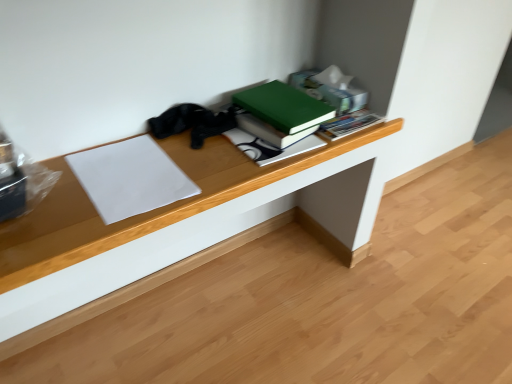
Question: Is green matte book at upper center, positioned as the second paperback book in left-to-right order, located outside wooden desk at center?

Choices:
 (A) yes
 (B) no

Answer: (A)

Question: Does green matte book at upper center, which is the 1th paperback book from back to front, come in front of wooden desk at center?

Choices:
 (A) yes
 (B) no

Answer: (A)

Question: Does green matte book at upper center, which is counted as the 2th paperback book, starting from the front, have a greater width compared to wooden desk at center?

Choices:
 (A) no
 (B) yes

Answer: (B)

Question: Does green matte book at upper center, placed as the first paperback book when sorted from top to bottom, have a lesser width compared to wooden desk at center?

Choices:
 (A) yes
 (B) no

Answer: (B)

Question: From a real-world perspective, is green matte book at upper center, acting as the first paperback book starting from the right, located higher than wooden desk at center?

Choices:
 (A) yes
 (B) no

Answer: (A)

Question: In terms of height, does green matte book at upper center, acting as the first paperback book starting from the right, look taller or shorter compared to white paper at left, which appears as the second paperback book when viewed from the right?

Choices:
 (A) short
 (B) tall

Answer: (B)

Question: From the image's perspective, is green matte book at upper center, which is the 1th paperback book from back to front, above or below white paper at left, arranged as the first paperback book when viewed from the front?

Choices:
 (A) above
 (B) below

Answer: (A)

Question: Is point (329, 114) positioned closer to the camera than point (100, 195)?

Choices:
 (A) farther
 (B) closer

Answer: (A)

Question: From a real-world perspective, is green matte book at upper center, which is the 1th paperback book from back to front, above or below white paper at left, placed as the first paperback book when sorted from bottom to top?

Choices:
 (A) below
 (B) above

Answer: (B)

Question: From a real-world perspective, relative to white paper at left, placed as the 2th paperback book when sorted from top to bottom, is wooden desk at center vertically above or below?

Choices:
 (A) above
 (B) below

Answer: (B)

Question: Is point pos(333,241) closer or farther from the camera than point pos(124,175)?

Choices:
 (A) closer
 (B) farther

Answer: (B)

Question: In terms of height, does wooden desk at center look taller or shorter compared to white paper at left, arranged as the first paperback book when viewed from the front?

Choices:
 (A) short
 (B) tall

Answer: (B)

Question: In terms of size, does wooden desk at center appear bigger or smaller than white paper at left, placed as the 2th paperback book when sorted from top to bottom?

Choices:
 (A) big
 (B) small

Answer: (A)

Question: From the image's perspective, is white paper at left, placed as the 2th paperback book when sorted from top to bottom, positioned above or below green matte book at upper center, positioned as the second paperback book in left-to-right order?

Choices:
 (A) below
 (B) above

Answer: (A)

Question: Based on their sizes in the image, would you say white paper at left, placed as the first paperback book when sorted from bottom to top, is bigger or smaller than green matte book at upper center, which is the 1th paperback book from back to front?

Choices:
 (A) small
 (B) big

Answer: (A)